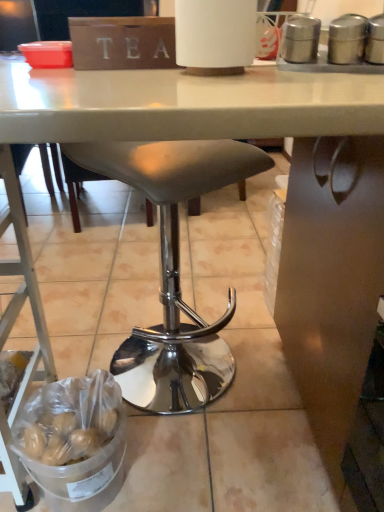
Question: Are silver metallic canisters at upper right and metallic silver ladder at lower left beside each other?

Choices:
 (A) yes
 (B) no

Answer: (B)

Question: Can you confirm if silver metallic canisters at upper right is thinner than metallic silver ladder at lower left?

Choices:
 (A) no
 (B) yes

Answer: (B)

Question: Considering the relative positions of silver metallic canisters at upper right and metallic silver ladder at lower left in the image provided, is silver metallic canisters at upper right to the right of metallic silver ladder at lower left from the viewer's perspective?

Choices:
 (A) yes
 (B) no

Answer: (A)

Question: From a real-world perspective, is silver metallic canisters at upper right below metallic silver ladder at lower left?

Choices:
 (A) yes
 (B) no

Answer: (B)

Question: Is silver metallic canisters at upper right bigger than metallic silver ladder at lower left?

Choices:
 (A) no
 (B) yes

Answer: (A)

Question: Is metallic silver ladder at lower left situated inside silver metallic canisters at upper right or outside?

Choices:
 (A) inside
 (B) outside

Answer: (B)

Question: From the image's perspective, is metallic silver ladder at lower left located above or below silver metallic canisters at upper right?

Choices:
 (A) below
 (B) above

Answer: (A)

Question: Relative to silver metallic canisters at upper right, is metallic silver ladder at lower left in front or behind?

Choices:
 (A) front
 (B) behind

Answer: (A)

Question: Considering the positions of point (3, 480) and point (362, 31), is point (3, 480) closer or farther from the camera than point (362, 31)?

Choices:
 (A) farther
 (B) closer

Answer: (A)

Question: Does point (31, 287) appear closer or farther from the camera than point (178, 393)?

Choices:
 (A) farther
 (B) closer

Answer: (B)

Question: Is metallic silver ladder at lower left in front of or behind matte gray stool at center in the image?

Choices:
 (A) front
 (B) behind

Answer: (A)

Question: Is metallic silver ladder at lower left taller or shorter than matte gray stool at center?

Choices:
 (A) short
 (B) tall

Answer: (A)

Question: From a real-world perspective, is metallic silver ladder at lower left positioned above or below matte gray stool at center?

Choices:
 (A) below
 (B) above

Answer: (A)

Question: From their relative heights in the image, would you say matte gray stool at center is taller or shorter than metallic silver ladder at lower left?

Choices:
 (A) short
 (B) tall

Answer: (B)

Question: Based on their positions, is matte gray stool at center located to the left or right of metallic silver ladder at lower left?

Choices:
 (A) right
 (B) left

Answer: (A)